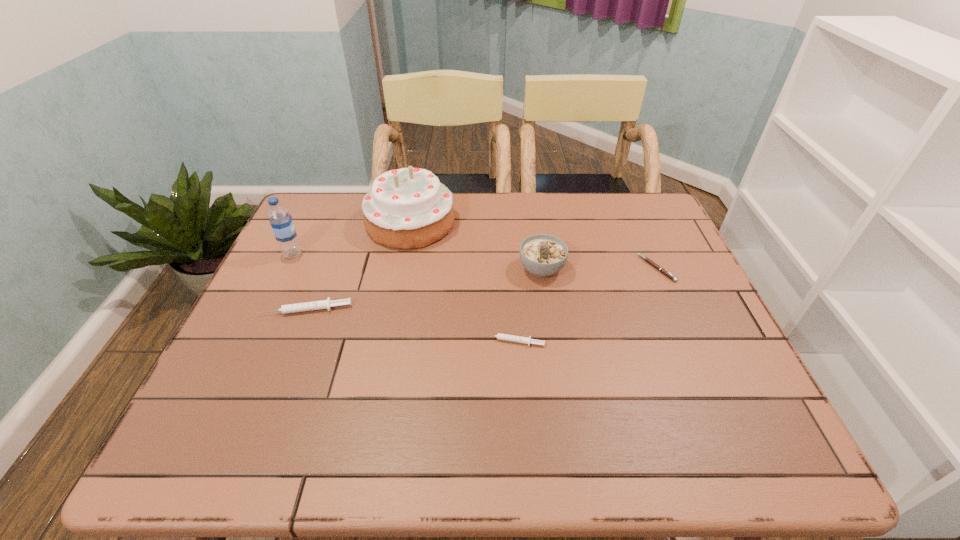
In order to click on vacant space that satisfies the following two spatial constraints: 1. on the label of the shorter syringe; 2. on the right side of the water bottle in this screenshot , I will do `click(251, 342)`.

At what (x,y) coordinates should I click in order to perform the action: click on vacant space that satisfies the following two spatial constraints: 1. on the back side of the nearer syringe; 2. on the label of the water bottle. Please return your answer as a coordinate pair (x, y). This screenshot has width=960, height=540. Looking at the image, I should click on (x=506, y=254).

Locate an element on the screen. The width and height of the screenshot is (960, 540). vacant space that satisfies the following two spatial constraints: 1. at the nib of the pen; 2. on the front side of the shorter syringe is located at coordinates (688, 342).

Where is `vacant area in the image that satisfies the following two spatial constraints: 1. on the back side of the cake; 2. on the right side of the second nearest object`? This screenshot has height=540, width=960. vacant area in the image that satisfies the following two spatial constraints: 1. on the back side of the cake; 2. on the right side of the second nearest object is located at coordinates (340, 223).

Locate an element on the screen. This screenshot has width=960, height=540. vacant space that satisfies the following two spatial constraints: 1. on the back side of the third tallest object; 2. on the label of the water bottle is located at coordinates (540, 254).

Where is `vacant region that satisfies the following two spatial constraints: 1. on the back side of the second shortest object; 2. on the left side of the soup bowl`? vacant region that satisfies the following two spatial constraints: 1. on the back side of the second shortest object; 2. on the left side of the soup bowl is located at coordinates (508, 269).